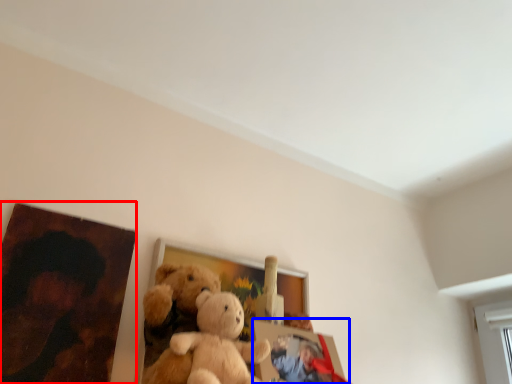
Question: Which object is closer to the camera taking this photo, picture frame (highlighted by a red box) or picture frame (highlighted by a blue box)?

Choices:
 (A) picture frame
 (B) picture frame

Answer: (A)